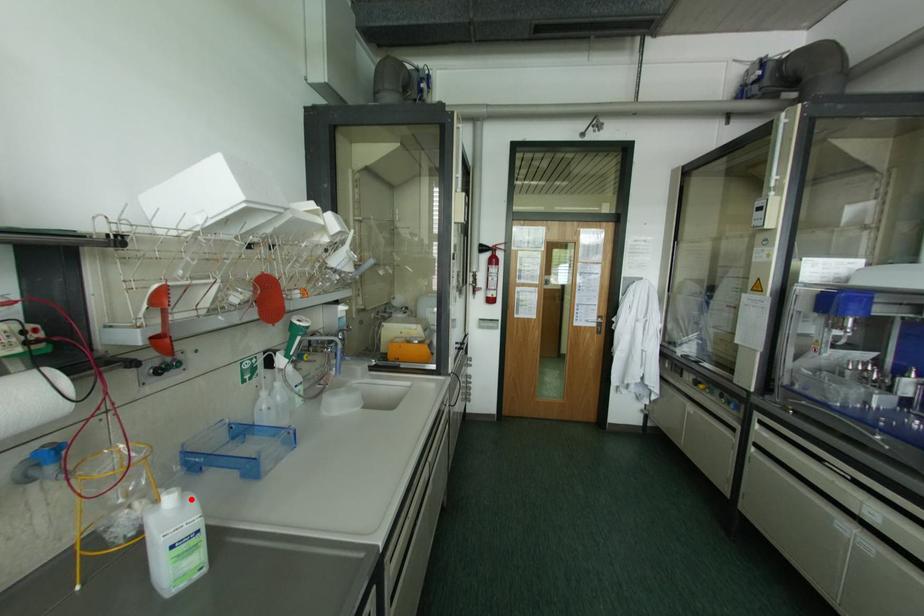
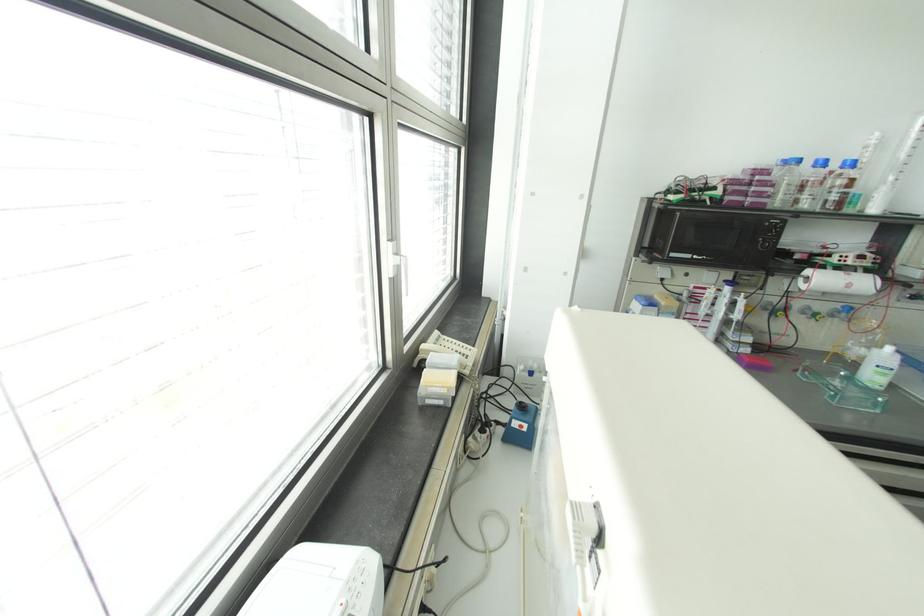
Find the pixel in the second image that matches the highlighted location in the first image.

(898, 355)